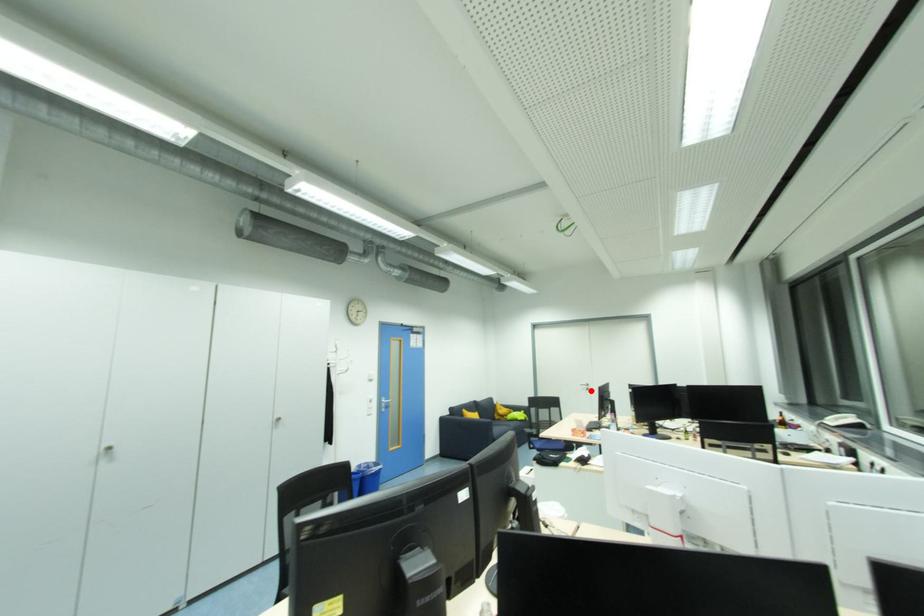
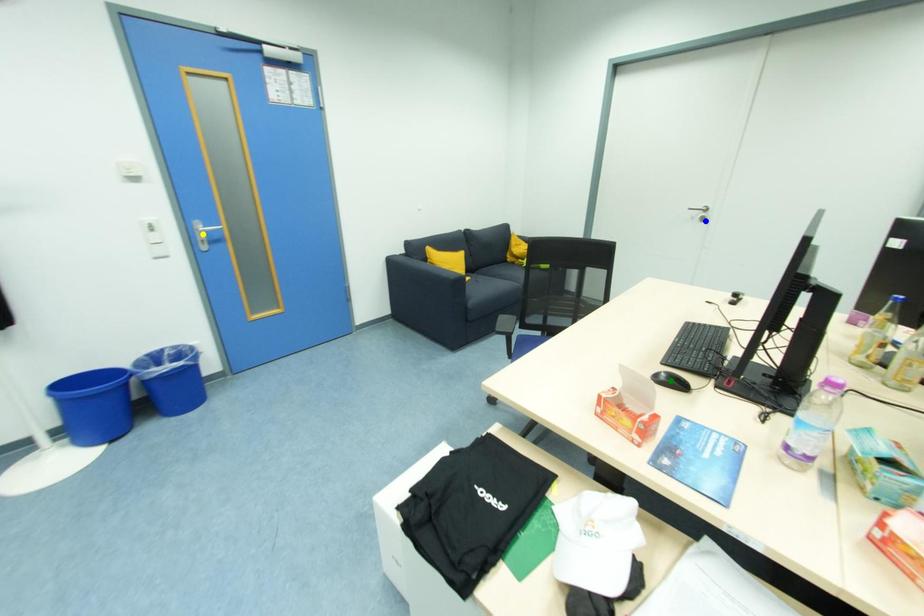
Question: I am providing you with two images of the same scene from different viewpoints. A red point is marked on the first image. You are given multiple points on the second image. Which spot in image 2 lines up with the point in image 1?

Choices:
 (A) yellow point
 (B) green point
 (C) blue point

Answer: (C)